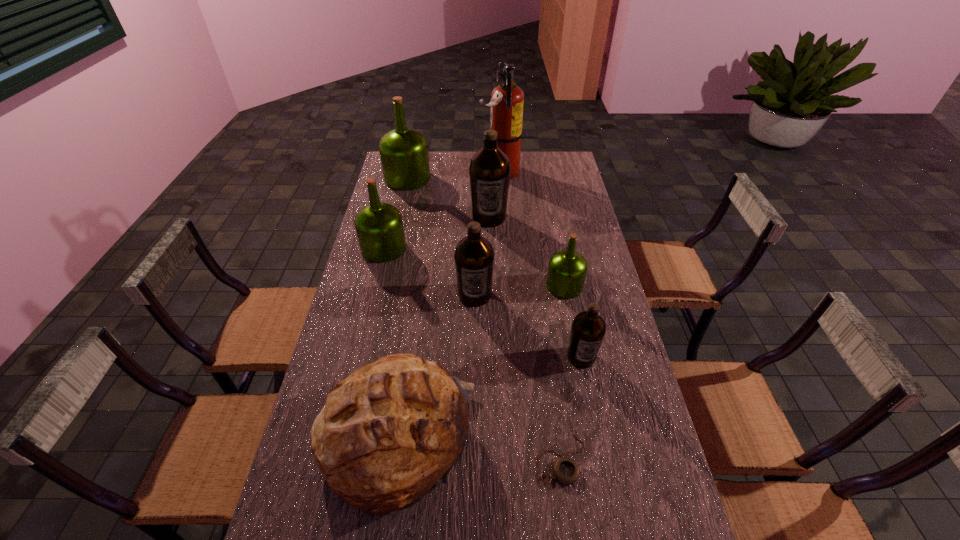
The height and width of the screenshot is (540, 960). Identify the location of red fire extinguisher. (507, 99).

Image resolution: width=960 pixels, height=540 pixels. Identify the location of fire extinguisher. (507, 99).

Where is `the farthest olive oil`? Image resolution: width=960 pixels, height=540 pixels. the farthest olive oil is located at coordinates (404, 155).

Find the location of a particular element. The image size is (960, 540). the farthest green olive oil is located at coordinates (404, 155).

The height and width of the screenshot is (540, 960). Find the location of `the fifth nearest olive oil`. the fifth nearest olive oil is located at coordinates coord(489,170).

Find the location of a particular element. The image size is (960, 540). the biggest brown olive oil is located at coordinates (489, 170).

At what (x,y) coordinates should I click in order to perform the action: click on the sixth nearest object. Please return your answer as a coordinate pair (x, y). The image size is (960, 540). Looking at the image, I should click on (379, 226).

Identify the location of the second smallest green olive oil. This screenshot has width=960, height=540. (379, 226).

Locate an element on the screen. the second farthest brown olive oil is located at coordinates (474, 255).

Where is `the rightmost brown olive oil`? This screenshot has height=540, width=960. the rightmost brown olive oil is located at coordinates (588, 328).